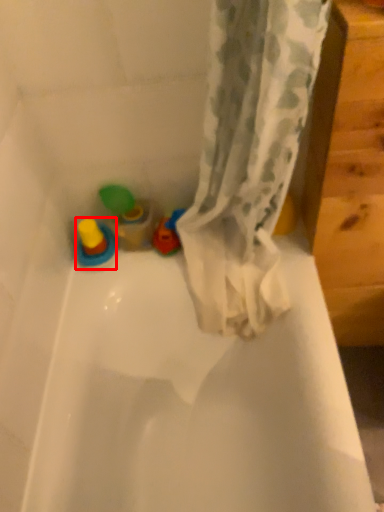
Question: Where is toy (annotated by the red box) located in relation to toy in the image?

Choices:
 (A) left
 (B) right

Answer: (A)